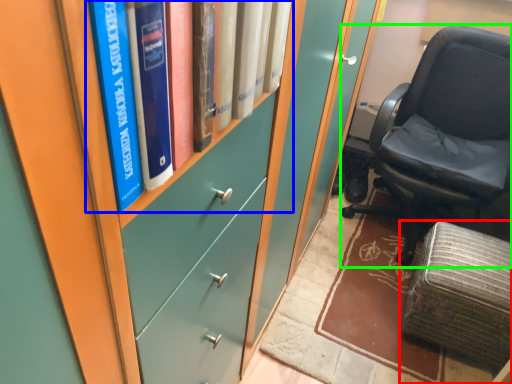
Question: Estimate the real-world distances between objects in this image. Which object is closer to furniture (highlighted by a red box), book (highlighted by a blue box) or chair (highlighted by a green box)?

Choices:
 (A) book
 (B) chair

Answer: (B)